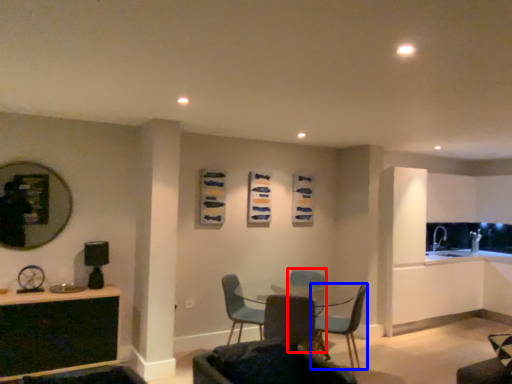
Question: Which object appears farthest to the camera in this image, armchair (highlighted by a red box) or chair (highlighted by a blue box)?

Choices:
 (A) armchair
 (B) chair

Answer: (A)